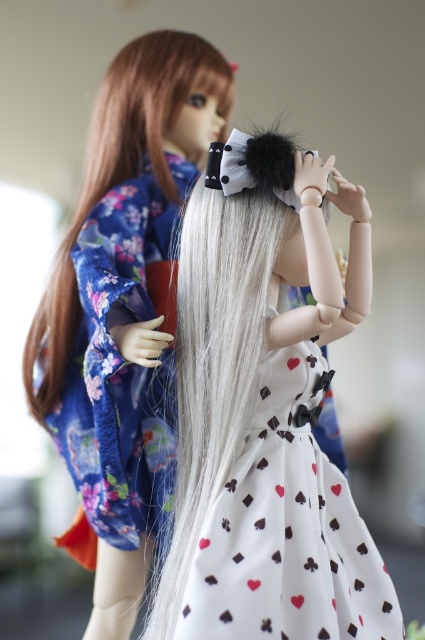
Question: Can you confirm if white printed fabric dress at center is positioned below white matte dress at center?

Choices:
 (A) no
 (B) yes

Answer: (B)

Question: Which of these objects is positioned farthest from the white printed fabric dress at center?

Choices:
 (A) white silky hair at upper left
 (B) white matte dress at center

Answer: (A)

Question: Which object is positioned farthest from the white matte dress at center?

Choices:
 (A) white printed fabric dress at center
 (B) white silky hair at upper left

Answer: (A)

Question: Considering the relative positions of white matte dress at center and white silky hair at upper left in the image provided, where is white matte dress at center located with respect to white silky hair at upper left?

Choices:
 (A) above
 (B) below

Answer: (B)

Question: Can you confirm if white matte dress at center is bigger than white silky hair at upper left?

Choices:
 (A) yes
 (B) no

Answer: (B)

Question: Considering the real-world distances, which object is farthest from the white matte dress at center?

Choices:
 (A) white printed fabric dress at center
 (B) white silky hair at upper left

Answer: (A)